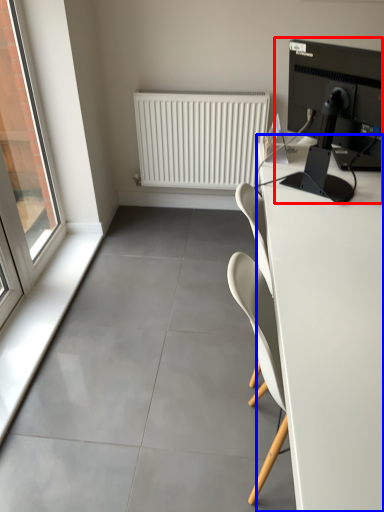
Question: Which object appears closest to the camera in this image, desktop computer (highlighted by a red box) or desk (highlighted by a blue box)?

Choices:
 (A) desktop computer
 (B) desk

Answer: (B)